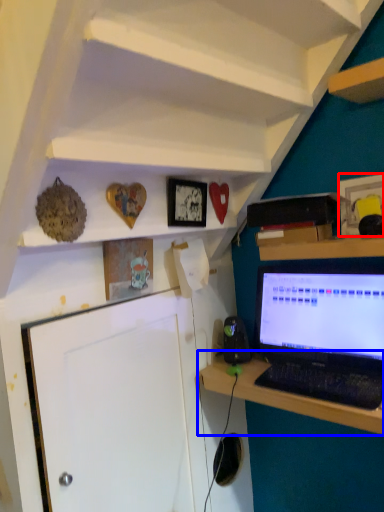
Question: Among these objects, which one is nearest to the camera, picture frame (highlighted by a red box) or desk (highlighted by a blue box)?

Choices:
 (A) picture frame
 (B) desk

Answer: (B)